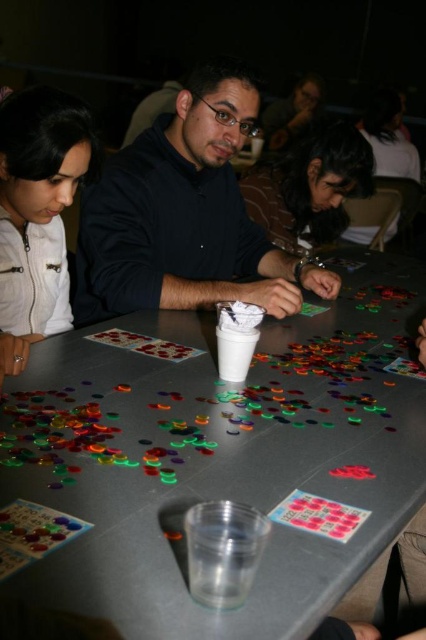
You are a person who wants to place a 18 inch long object on the table. Can you place it between the translucent plastic table at center and the matte white jacket at upper left without moving either object?

The distance between the translucent plastic table at center and the matte white jacket at upper left is 17.58 inches. Since the object is 18 inches long, it cannot be placed between them without moving either object because the space is slightly shorter than the object.

You are a photographer at the event and want to take a photo of the dark brown hair at center without the matte white jacket at upper left appearing in the frame. Is this possible given their positions?

The matte white jacket at upper left is positioned under dark brown hair at center, so the dark brown hair at center would block the jacket from view. Yes, it is possible to take a photo of the dark brown hair at center without the matte white jacket at upper left appearing in the frame.

You are standing at the edge of the table where the game is taking place. You want to hand a token to both the person wearing the matte black shirt at center and the person wearing the matte white jacket at upper left. Which person will you reach first?

The matte black shirt at center is closer to you than the matte white jacket at upper left, so you will reach the person wearing the matte black shirt at center first.